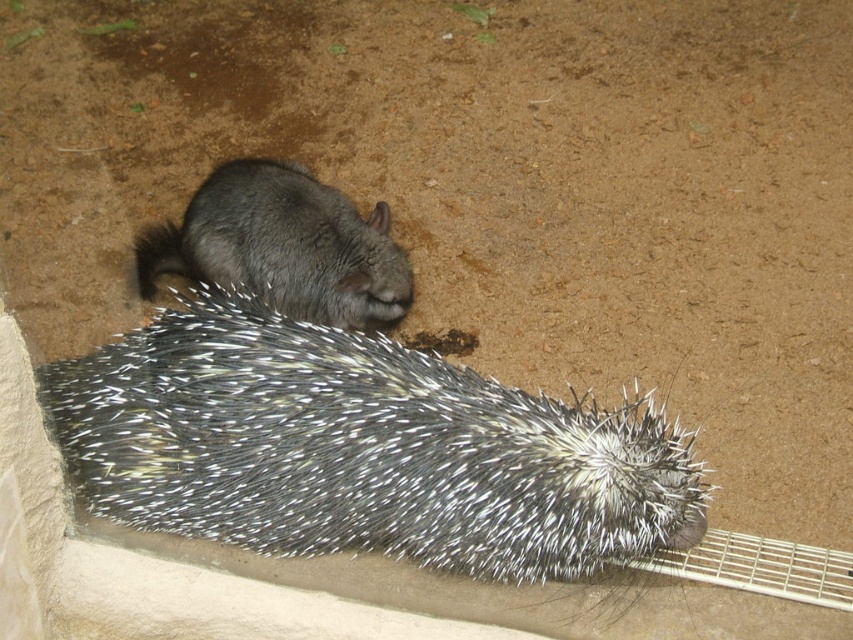
Question: Which object appears farthest from the camera in this image?

Choices:
 (A) spiky fur hedgehog at lower left
 (B) gray furry rodent at center

Answer: (B)

Question: Can you confirm if spiky fur hedgehog at lower left is positioned to the left of gray furry rodent at center?

Choices:
 (A) no
 (B) yes

Answer: (A)

Question: Which object appears closest to the camera in this image?

Choices:
 (A) gray furry rodent at center
 (B) spiky fur hedgehog at lower left

Answer: (B)

Question: Considering the relative positions of spiky fur hedgehog at lower left and gray furry rodent at center in the image provided, where is spiky fur hedgehog at lower left located with respect to gray furry rodent at center?

Choices:
 (A) above
 (B) below

Answer: (B)

Question: Which point is farther from the camera taking this photo?

Choices:
 (A) (341, 198)
 (B) (238, 328)

Answer: (A)

Question: Is spiky fur hedgehog at lower left smaller than gray furry rodent at center?

Choices:
 (A) yes
 (B) no

Answer: (B)